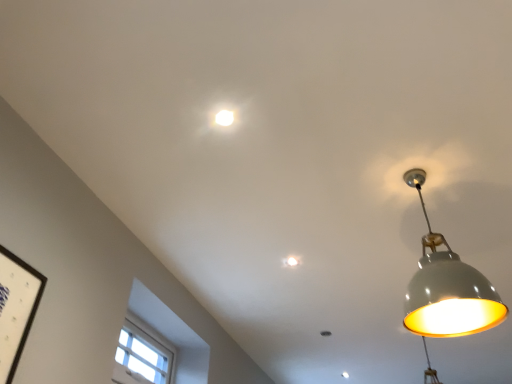
Image resolution: width=512 pixels, height=384 pixels. In order to click on white wooden window at lower left in this screenshot , I will do `click(142, 357)`.

What are the coordinates of `white wooden window at lower left` in the screenshot? It's located at (142, 357).

Could white wooden window at lower left be considered to be inside matte gray lampshade at right, positioned as the first lamp in bottom-to-top order?

No, white wooden window at lower left is not surrounded by matte gray lampshade at right, positioned as the first lamp in bottom-to-top order.

Can you confirm if matte gray lampshade at right, the first lamp viewed from the front, is smaller than white wooden window at lower left?

Incorrect, matte gray lampshade at right, the first lamp viewed from the front, is not smaller in size than white wooden window at lower left.

Is matte gray lampshade at right, positioned as the second lamp in top-to-bottom order, positioned behind white wooden window at lower left?

No, matte gray lampshade at right, positioned as the second lamp in top-to-bottom order, is in front of white wooden window at lower left.

From the image's perspective, between matte gray lampshade at right, the second lamp positioned from the left, and white wooden window at lower left, which one is located above?

matte gray lampshade at right, the second lamp positioned from the left, appears higher in the image.

Looking at the image, does white wooden window at lower left seem bigger or smaller compared to matte gray lampshade at right, which is the 2th lamp from back to front?

Clearly, white wooden window at lower left is smaller in size than matte gray lampshade at right, which is the 2th lamp from back to front.

Considering the relative positions of white wooden window at lower left and matte gray lampshade at right, positioned as the first lamp in bottom-to-top order, in the image provided, is white wooden window at lower left to the left of matte gray lampshade at right, positioned as the first lamp in bottom-to-top order, from the viewer's perspective?

Yes, white wooden window at lower left is to the left of matte gray lampshade at right, positioned as the first lamp in bottom-to-top order.

Can you confirm if white wooden window at lower left is taller than matte gray lampshade at right, positioned as the first lamp in bottom-to-top order?

Incorrect, the height of white wooden window at lower left is not larger of that of matte gray lampshade at right, positioned as the first lamp in bottom-to-top order.

From the image's perspective, which is above, white wooden window at lower left or matte gray lampshade at right, which is the 2th lamp from back to front?

matte gray lampshade at right, which is the 2th lamp from back to front, is shown above in the image.

Find the location of a particular element. The height and width of the screenshot is (384, 512). window that is under the white glossy light fixture at upper center, the first lamp viewed from the top (from a real-world perspective) is located at coordinates (142, 357).

From the image's perspective, is white glossy light fixture at upper center, the 1th lamp viewed from the left, under white wooden window at lower left?

No.

In the scene shown: Considering the positions of objects white glossy light fixture at upper center, which appears as the 2th lamp when viewed from the right, and white wooden window at lower left in the image provided, who is behind, white glossy light fixture at upper center, which appears as the 2th lamp when viewed from the right, or white wooden window at lower left?

Result: Positioned behind is white wooden window at lower left.

Is white glossy light fixture at upper center, the first lamp from the back, oriented away from white wooden window at lower left?

No, white glossy light fixture at upper center, the first lamp from the back, is not facing the opposite direction of white wooden window at lower left.

Is matte gray lampshade at right, positioned as the first lamp in bottom-to-top order, situated inside white glossy light fixture at upper center, which appears as the 2th lamp when viewed from the right, or outside?

matte gray lampshade at right, positioned as the first lamp in bottom-to-top order, lies outside white glossy light fixture at upper center, which appears as the 2th lamp when viewed from the right.

Consider the image. Is matte gray lampshade at right, which is the 2th lamp from back to front, looking in the opposite direction of white glossy light fixture at upper center, the 1th lamp viewed from the left?

No, matte gray lampshade at right, which is the 2th lamp from back to front, is not facing away from white glossy light fixture at upper center, the 1th lamp viewed from the left.

Considering their positions, is matte gray lampshade at right, the first lamp viewed from the front, located in front of or behind white glossy light fixture at upper center, the second lamp positioned from the bottom?

matte gray lampshade at right, the first lamp viewed from the front, is positioned closer to the viewer than white glossy light fixture at upper center, the second lamp positioned from the bottom.

Is matte gray lampshade at right, the second lamp positioned from the left, at the left side of white glossy light fixture at upper center, acting as the second lamp starting from the front?

In fact, matte gray lampshade at right, the second lamp positioned from the left, is to the right of white glossy light fixture at upper center, acting as the second lamp starting from the front.

Is the depth of white glossy light fixture at upper center, acting as the second lamp starting from the front, less than that of matte gray lampshade at right, the second lamp positioned from the left?

No, it is not.

From the image's perspective, which is above, white glossy light fixture at upper center, the 1th lamp viewed from the left, or matte gray lampshade at right, positioned as the first lamp in bottom-to-top order?

white glossy light fixture at upper center, the 1th lamp viewed from the left, from the image's perspective.

Can we say white glossy light fixture at upper center, the second lamp positioned from the bottom, lies outside matte gray lampshade at right, the first lamp viewed from the front?

white glossy light fixture at upper center, the second lamp positioned from the bottom, is positioned outside matte gray lampshade at right, the first lamp viewed from the front.

Is white glossy light fixture at upper center, the first lamp viewed from the top, bigger or smaller than matte gray lampshade at right, the second lamp positioned from the left?

Clearly, white glossy light fixture at upper center, the first lamp viewed from the top, is smaller in size than matte gray lampshade at right, the second lamp positioned from the left.

Is white wooden window at lower left oriented towards white glossy light fixture at upper center, acting as the second lamp starting from the front?

No.

From a real-world perspective, who is located higher, white wooden window at lower left or white glossy light fixture at upper center, the 1th lamp viewed from the left?

white glossy light fixture at upper center, the 1th lamp viewed from the left, from a real-world perspective.

Based on the photo, in terms of height, does white wooden window at lower left look taller or shorter compared to white glossy light fixture at upper center, acting as the second lamp starting from the front?

In the image, white wooden window at lower left appears to be taller than white glossy light fixture at upper center, acting as the second lamp starting from the front.

The image size is (512, 384). Find the location of `the 1st lamp above the white wooden window at lower left (from a real-world perspective)`. the 1st lamp above the white wooden window at lower left (from a real-world perspective) is located at coordinates (447, 288).

Starting from the white wooden window at lower left, which lamp is the 2nd one in front? Please provide its 2D coordinates.

[(447, 288)]

Based on their spatial positions, is white glossy light fixture at upper center, the second lamp positioned from the bottom, or white wooden window at lower left closer to matte gray lampshade at right, the second lamp positioned from the left?

Among the two, white glossy light fixture at upper center, the second lamp positioned from the bottom, is located nearer to matte gray lampshade at right, the second lamp positioned from the left.

Looking at the image, which one is located closer to white wooden window at lower left, matte gray lampshade at right, which is the 2th lamp from back to front, or white glossy light fixture at upper center, the first lamp from the back?

matte gray lampshade at right, which is the 2th lamp from back to front, is closer to white wooden window at lower left.

Based on their spatial positions, is white wooden window at lower left or matte gray lampshade at right, which ranks as the 1th lamp in right-to-left order, closer to white glossy light fixture at upper center, the first lamp from the back?

Based on the image, matte gray lampshade at right, which ranks as the 1th lamp in right-to-left order, appears to be nearer to white glossy light fixture at upper center, the first lamp from the back.

From the image, which object appears to be nearer to white glossy light fixture at upper center, the first lamp from the back, matte gray lampshade at right, which ranks as the 1th lamp in right-to-left order, or white wooden window at lower left?

matte gray lampshade at right, which ranks as the 1th lamp in right-to-left order, lies closer to white glossy light fixture at upper center, the first lamp from the back, than the other object.

Estimate the real-world distances between objects in this image. Which object is further from matte gray lampshade at right, positioned as the second lamp in top-to-bottom order, white wooden window at lower left or white glossy light fixture at upper center, the first lamp viewed from the top?

white wooden window at lower left.

From the image, which object appears to be nearer to white wooden window at lower left, white glossy light fixture at upper center, the 1th lamp viewed from the left, or matte gray lampshade at right, the first lamp viewed from the front?

The object closer to white wooden window at lower left is matte gray lampshade at right, the first lamp viewed from the front.

Find the location of a particular element. The width and height of the screenshot is (512, 384). lamp between white wooden window at lower left and matte gray lampshade at right, the first lamp viewed from the front, in the horizontal direction is located at coordinates (224, 117).